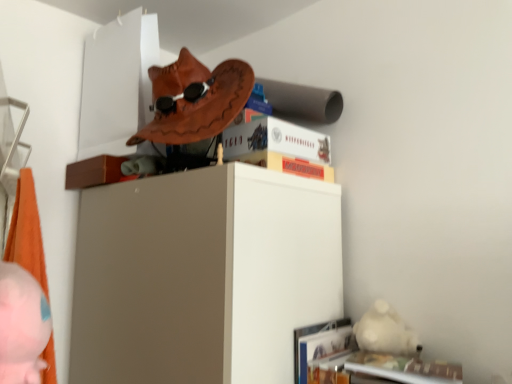
Question: Is hardcover book at upper center, the 1th paperback book positioned from the top, bigger than monopoly board game at upper center, which ranks as the 2th paperback book in top-to-bottom order?

Choices:
 (A) no
 (B) yes

Answer: (B)

Question: Considering the relative positions of hardcover book at upper center, which ranks as the 2th paperback book in bottom-to-top order, and monopoly board game at upper center, which ranks as the 2th paperback book in top-to-bottom order, in the image provided, is hardcover book at upper center, which ranks as the 2th paperback book in bottom-to-top order, behind monopoly board game at upper center, which ranks as the 2th paperback book in top-to-bottom order,?

Choices:
 (A) yes
 (B) no

Answer: (A)

Question: Would you say hardcover book at upper center, the 1th paperback book positioned from the top, is outside monopoly board game at upper center, the 1th paperback book in the bottom-to-top sequence?

Choices:
 (A) yes
 (B) no

Answer: (A)

Question: From a real-world perspective, is hardcover book at upper center, which ranks as the 2th paperback book in bottom-to-top order, on top of monopoly board game at upper center, which ranks as the 2th paperback book in top-to-bottom order?

Choices:
 (A) yes
 (B) no

Answer: (A)

Question: Is hardcover book at upper center, the 1th paperback book positioned from the top, shorter than monopoly board game at upper center, which ranks as the 2th paperback book in top-to-bottom order?

Choices:
 (A) no
 (B) yes

Answer: (A)

Question: Is hardcover book at upper center, which ranks as the 2th paperback book in bottom-to-top order, aimed at monopoly board game at upper center, the 1th paperback book in the bottom-to-top sequence?

Choices:
 (A) no
 (B) yes

Answer: (A)

Question: From the image's perspective, is pink plush toy at lower left under hardcover book at upper center, the 1th paperback book positioned from the top?

Choices:
 (A) no
 (B) yes

Answer: (B)

Question: Does pink plush toy at lower left lie in front of hardcover book at upper center, which ranks as the 2th paperback book in bottom-to-top order?

Choices:
 (A) yes
 (B) no

Answer: (A)

Question: Is pink plush toy at lower left positioned behind hardcover book at upper center, which ranks as the 2th paperback book in bottom-to-top order?

Choices:
 (A) no
 (B) yes

Answer: (A)

Question: Considering the relative sizes of pink plush toy at lower left and hardcover book at upper center, the 1th paperback book positioned from the top, in the image provided, is pink plush toy at lower left thinner than hardcover book at upper center, the 1th paperback book positioned from the top,?

Choices:
 (A) no
 (B) yes

Answer: (B)

Question: From a real-world perspective, is pink plush toy at lower left under hardcover book at upper center, the 1th paperback book positioned from the top?

Choices:
 (A) yes
 (B) no

Answer: (A)

Question: Is pink plush toy at lower left next to hardcover book at upper center, the 1th paperback book positioned from the top?

Choices:
 (A) no
 (B) yes

Answer: (A)

Question: From a real-world perspective, is monopoly board game at upper center, the 1th paperback book in the bottom-to-top sequence, physically below hardcover book at upper center, the 1th paperback book positioned from the top?

Choices:
 (A) no
 (B) yes

Answer: (B)